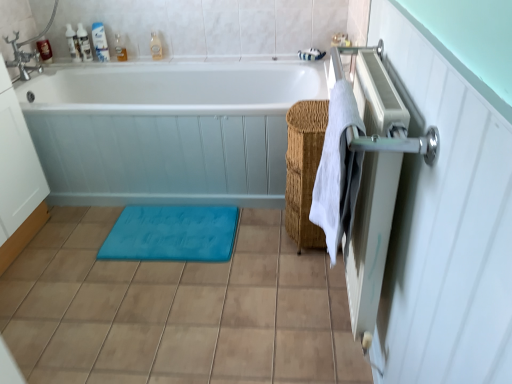
What are the coordinates of `free space to the left of white glossy bottle at upper left, the fourth toiletry viewed from the left` in the screenshot? It's located at (79, 57).